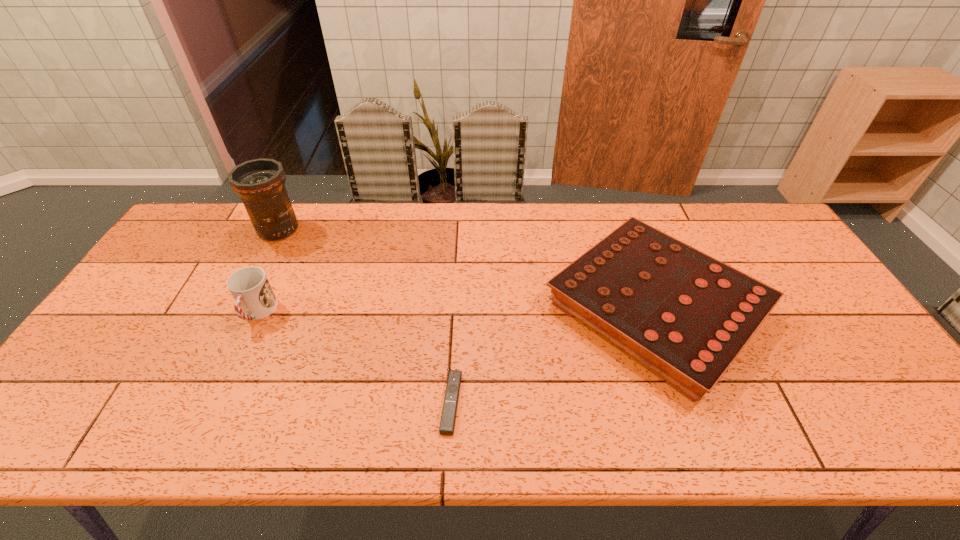
In order to click on telephoto lens positioned at the far edge in this screenshot , I will do `click(260, 183)`.

Where is `gameboard present at the far edge`? gameboard present at the far edge is located at coordinates (687, 316).

This screenshot has height=540, width=960. Find the location of `object that is positioned at the near edge`. object that is positioned at the near edge is located at coordinates (448, 417).

I want to click on free space at the far edge of the desktop, so click(585, 204).

Where is `blank space at the near edge of the desktop`? This screenshot has height=540, width=960. blank space at the near edge of the desktop is located at coordinates (476, 413).

Identify the location of free region at the left edge of the desktop. (156, 332).

In the image, there is a desktop. Identify the location of vacant space at the right edge. (864, 345).

At what (x,y) coordinates should I click in order to perform the action: click on blank space at the far left corner of the desktop. Please return your answer as a coordinate pair (x, y). Looking at the image, I should click on (204, 235).

Where is `vacant space at the far right corner of the desktop`? The height and width of the screenshot is (540, 960). vacant space at the far right corner of the desktop is located at coordinates (772, 229).

What are the coordinates of `vacant point located between the rightmost object and the telephoto lens` in the screenshot? It's located at (467, 269).